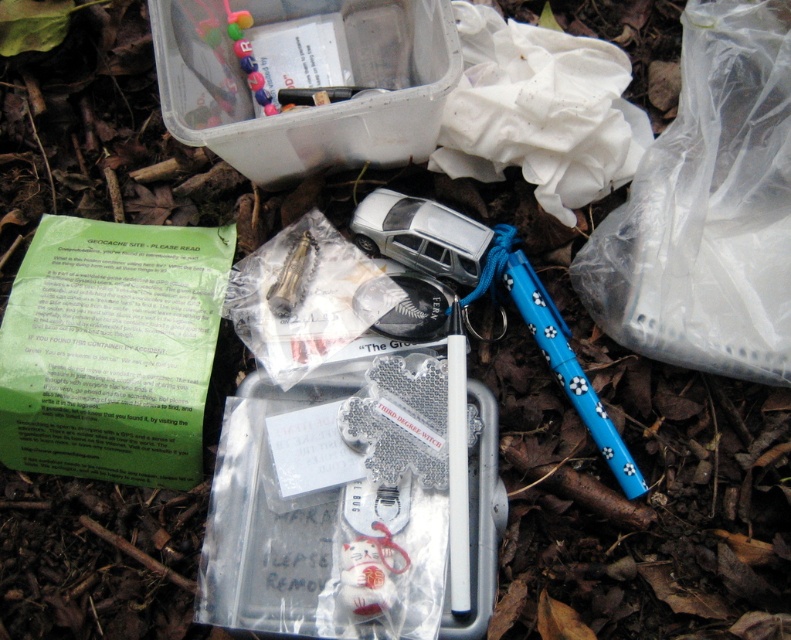
Measure the distance between blue plastic pen at lower right and camera.

blue plastic pen at lower right and camera are 3.88 feet apart from each other.

Does blue plastic pen at lower right have a greater width compared to porcelain white cat at center?

Yes.

The image size is (791, 640). What do you see at coordinates (559, 353) in the screenshot? I see `blue plastic pen at lower right` at bounding box center [559, 353].

Where is `blue plastic pen at lower right`? blue plastic pen at lower right is located at coordinates click(559, 353).

Is transparent plastic bag at upper right bigger than blue plastic pen at lower right?

Indeed, transparent plastic bag at upper right has a larger size compared to blue plastic pen at lower right.

Is transparent plastic bag at upper right to the left of blue plastic pen at lower right from the viewer's perspective?

Incorrect, transparent plastic bag at upper right is not on the left side of blue plastic pen at lower right.

Between point (725, 44) and point (568, 356), which one is positioned behind?

The point (568, 356) is behind.

This screenshot has width=791, height=640. Find the location of `transparent plastic bag at upper right`. transparent plastic bag at upper right is located at coordinates (706, 209).

Measure the distance between transparent plastic bag at upper right and porcelain white cat at center.

59.40 centimeters

Who is positioned more to the right, transparent plastic bag at upper right or porcelain white cat at center?

Positioned to the right is transparent plastic bag at upper right.

Between point (644, 269) and point (350, 586), which one is positioned in front?

Point (350, 586) is more forward.

The width and height of the screenshot is (791, 640). In order to click on transparent plastic bag at upper right in this screenshot , I will do `click(706, 209)`.